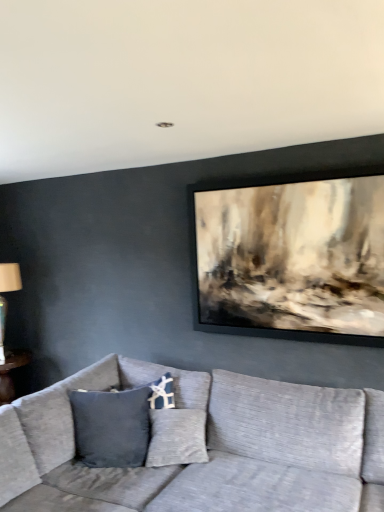
The width and height of the screenshot is (384, 512). What do you see at coordinates (206, 446) in the screenshot?
I see `textured gray couch at center` at bounding box center [206, 446].

At what (x,y) coordinates should I click in order to perform the action: click on textured gray couch at center. Please return your answer as a coordinate pair (x, y). Looking at the image, I should click on (206, 446).

This screenshot has height=512, width=384. I want to click on white fabric lampshade at left, so click(10, 277).

What do you see at coordinates (10, 277) in the screenshot? I see `white fabric lampshade at left` at bounding box center [10, 277].

This screenshot has height=512, width=384. I want to click on textured gray couch at center, so [x=206, y=446].

Between white fabric lampshade at left and textured gray couch at center, which one appears on the left side from the viewer's perspective?

white fabric lampshade at left.

Which object is further away from the camera, white fabric lampshade at left or textured gray couch at center?

white fabric lampshade at left.

Which is less distant, (16, 287) or (265, 414)?

Point (16, 287) appears to be farther away from the viewer than point (265, 414).

From the image's perspective, between white fabric lampshade at left and textured gray couch at center, who is located below?

textured gray couch at center, from the image's perspective.

From a real-world perspective, is white fabric lampshade at left located beneath textured gray couch at center?

No, from a real-world perspective, white fabric lampshade at left is not beneath textured gray couch at center.

Considering the sizes of objects white fabric lampshade at left and textured gray couch at center in the image provided, who is wider, white fabric lampshade at left or textured gray couch at center?

textured gray couch at center.

Which of these two, white fabric lampshade at left or textured gray couch at center, stands taller?

Standing taller between the two is white fabric lampshade at left.

Based on their sizes in the image, would you say white fabric lampshade at left is bigger or smaller than textured gray couch at center?

Clearly, white fabric lampshade at left is smaller in size than textured gray couch at center.

Would you say white fabric lampshade at left contains textured gray couch at center?

No, white fabric lampshade at left does not contain textured gray couch at center.

Are white fabric lampshade at left and textured gray couch at center making contact?

white fabric lampshade at left and textured gray couch at center are not in contact.

Is white fabric lampshade at left aimed at textured gray couch at center?

No, white fabric lampshade at left does not turn towards textured gray couch at center.

What's the angular difference between white fabric lampshade at left and textured gray couch at center's facing directions?

The angle between the facing direction of white fabric lampshade at left and the facing direction of textured gray couch at center is 0.382 degrees.

How distant is white fabric lampshade at left from textured gray couch at center?

white fabric lampshade at left is 2.09 meters from textured gray couch at center.

Locate an element on the screen. table lamp that is on the left side of textured gray couch at center is located at coordinates (10, 277).

Is textured gray couch at center at the right side of white fabric lampshade at left?

Yes, textured gray couch at center is to the right of white fabric lampshade at left.

Is the position of textured gray couch at center more distant than that of white fabric lampshade at left?

No, it is in front of white fabric lampshade at left.

Does point (56, 400) come behind point (2, 336)?

No, it is in front of (2, 336).

From the picture: From the image's perspective, is textured gray couch at center positioned above or below white fabric lampshade at left?

textured gray couch at center is below white fabric lampshade at left.

From a real-world perspective, which object rests below the other?

textured gray couch at center, from a real-world perspective.

Based on the photo, can you confirm if textured gray couch at center is wider than white fabric lampshade at left?

Correct, the width of textured gray couch at center exceeds that of white fabric lampshade at left.

Considering the sizes of objects textured gray couch at center and white fabric lampshade at left in the image provided, who is taller, textured gray couch at center or white fabric lampshade at left?

Standing taller between the two is white fabric lampshade at left.

Looking at this image, between textured gray couch at center and white fabric lampshade at left, which one has larger size?

Bigger between the two is textured gray couch at center.

Is textured gray couch at center inside or outside of white fabric lampshade at left?

textured gray couch at center is located beyond the bounds of white fabric lampshade at left.

Is textured gray couch at center touching white fabric lampshade at left?

No, textured gray couch at center is not in contact with white fabric lampshade at left.

Is textured gray couch at center looking in the opposite direction of white fabric lampshade at left?

No, white fabric lampshade at left is not at the back of textured gray couch at center.

Can you tell me how much textured gray couch at center and white fabric lampshade at left differ in facing direction?

The angular difference between textured gray couch at center and white fabric lampshade at left is 0.382 degrees.

This screenshot has width=384, height=512. Identify the location of table lamp above the textured gray couch at center (from a real-world perspective). (10, 277).

What are the coordinates of `studio couch that appears below the white fabric lampshade at left (from the image's perspective)` in the screenshot? It's located at (206, 446).

You are a GUI agent. You are given a task and a screenshot of the screen. Output one action in this format:
    pyautogui.click(x=<x>, y=<y>)
    Task: Click on the table lamp to the left of textured gray couch at center
    The image size is (384, 512).
    Given the screenshot: What is the action you would take?
    pyautogui.click(x=10, y=277)